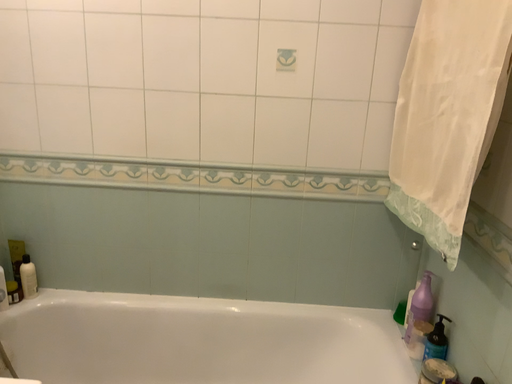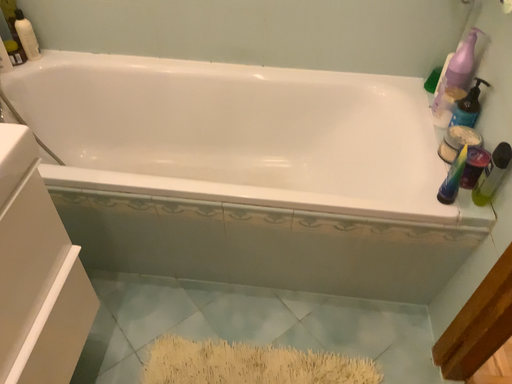
Question: Which way did the camera rotate in the video?

Choices:
 (A) rotated downward
 (B) rotated upward

Answer: (A)